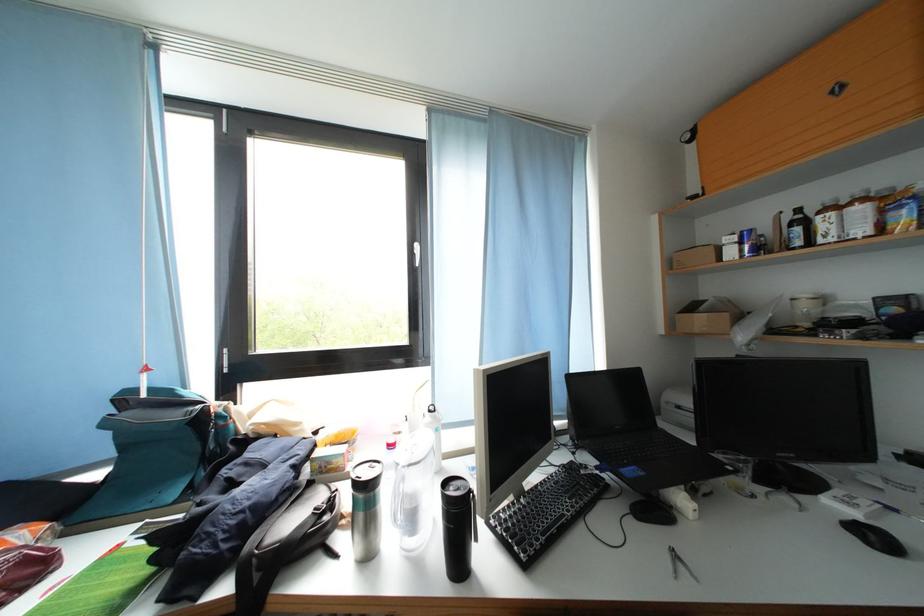
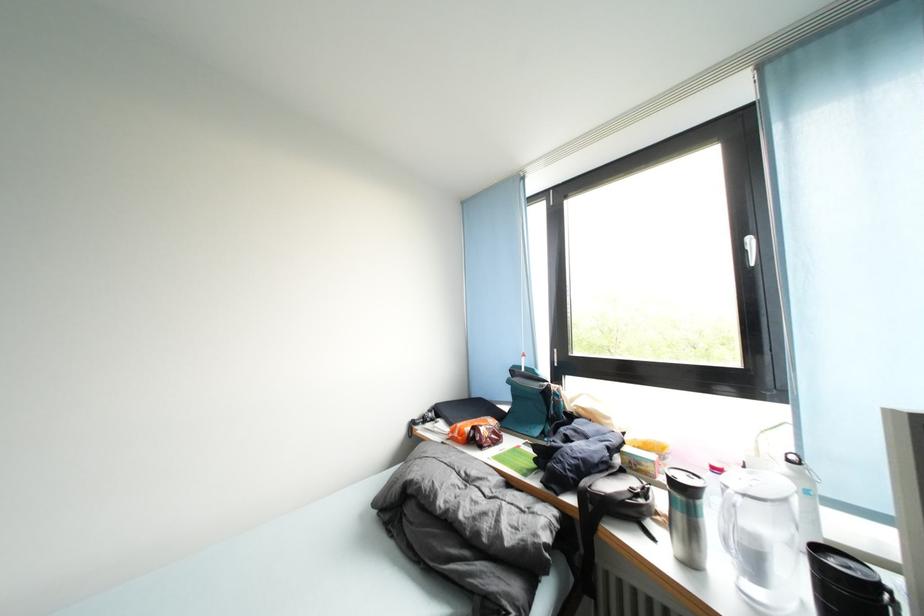
The point at (454,488) is marked in the first image. Where is the corresponding point in the second image?

(825, 552)